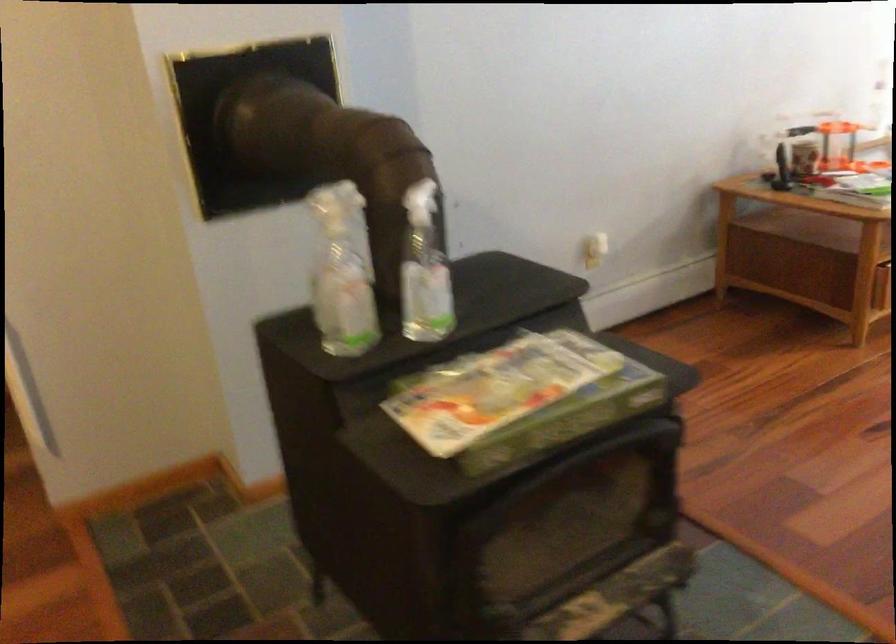
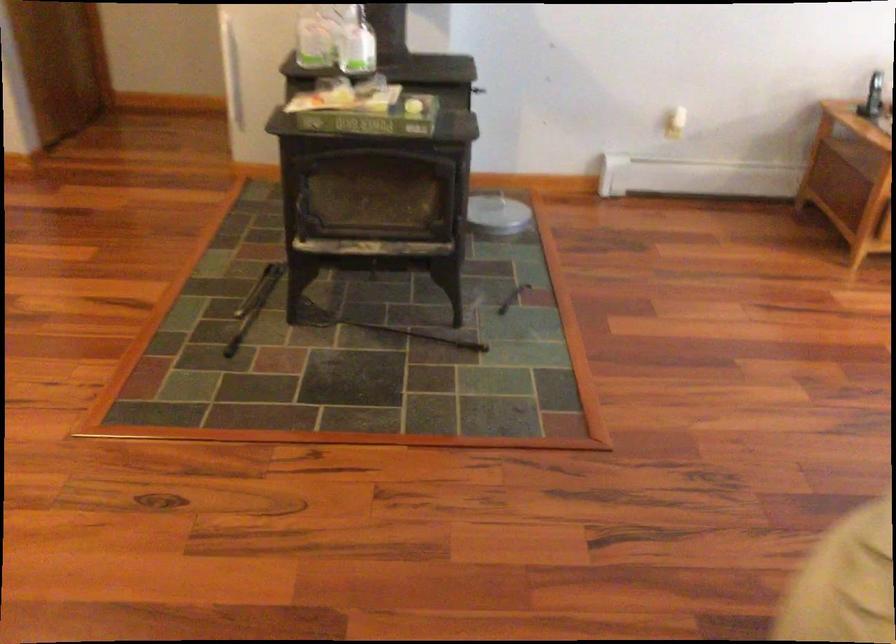
Locate, in the second image, the point that corresponds to pixel 359 303 in the first image.

(314, 41)